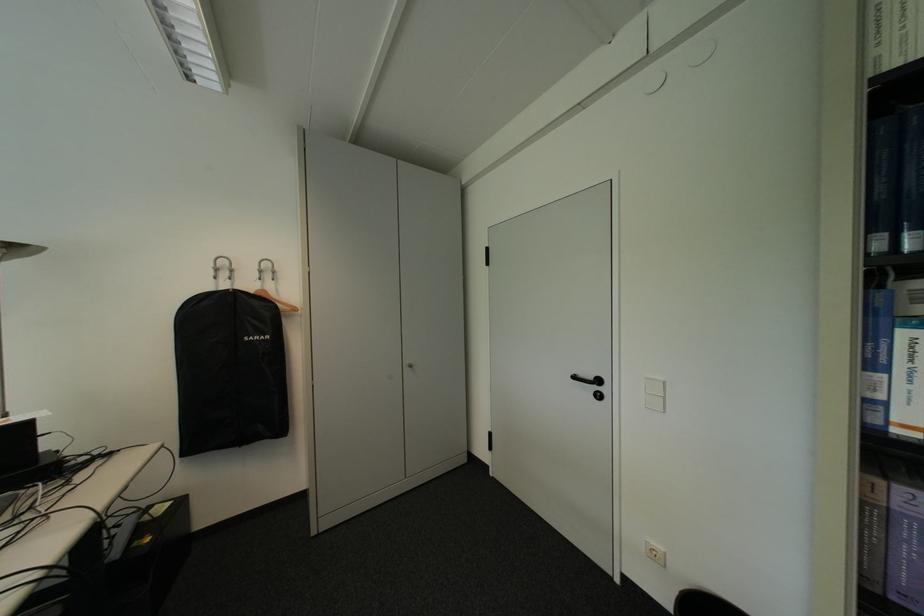
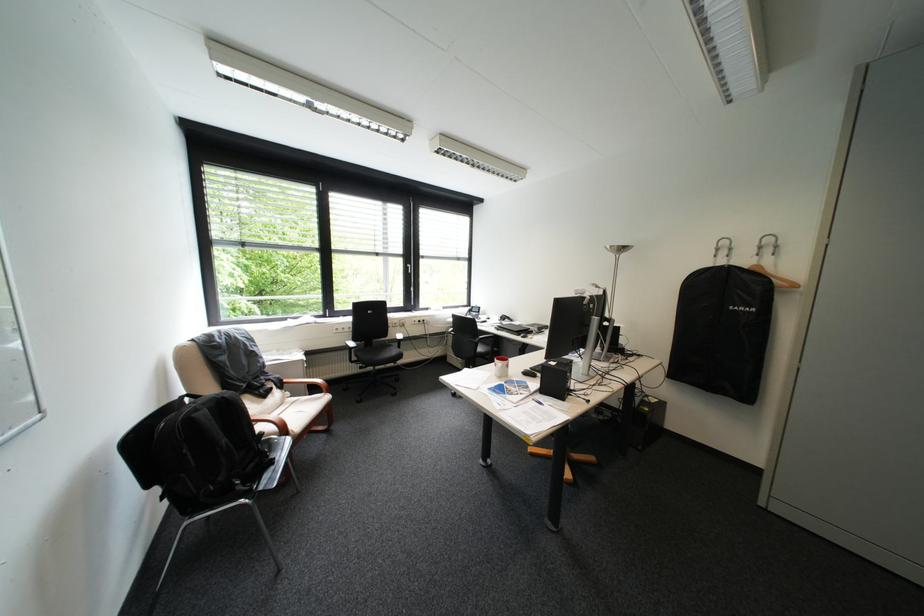
Find the pixel in the second image that matches pixel 286 273 in the first image.

(788, 246)